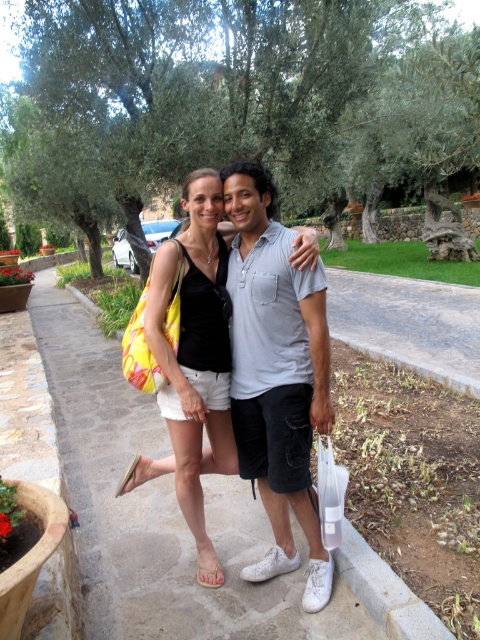
In the scene shown: You are a photographer trying to capture a candid shot of the two people in the image. The camera you are using has a focus point at point (276,374). Which person should you aim the focus point at to ensure the light gray cotton shirt at center is in focus?

The light gray cotton shirt at center is located at point (276,374), so you should aim the focus point at the light gray cotton shirt at center to ensure it is in focus.

Based on the photo, you are standing at point (x=207, y=266) and want to walk to point (x=288, y=356). Is the destination point in front of or behind your current position?

The destination point (x=288, y=356) is in front of your current position at point (x=207, y=266).

You are a photographer trying to capture a closeup of the light gray cotton shirt at center and the beige fabric sandal at lower center. Since you want both to be clearly visible, which one should you focus on first to ensure proper framing?

The light gray cotton shirt at center is bigger than the beige fabric sandal at lower center, so you should focus on the light gray cotton shirt at center first to ensure it fits within the frame before adjusting for the smaller beige fabric sandal at lower center.